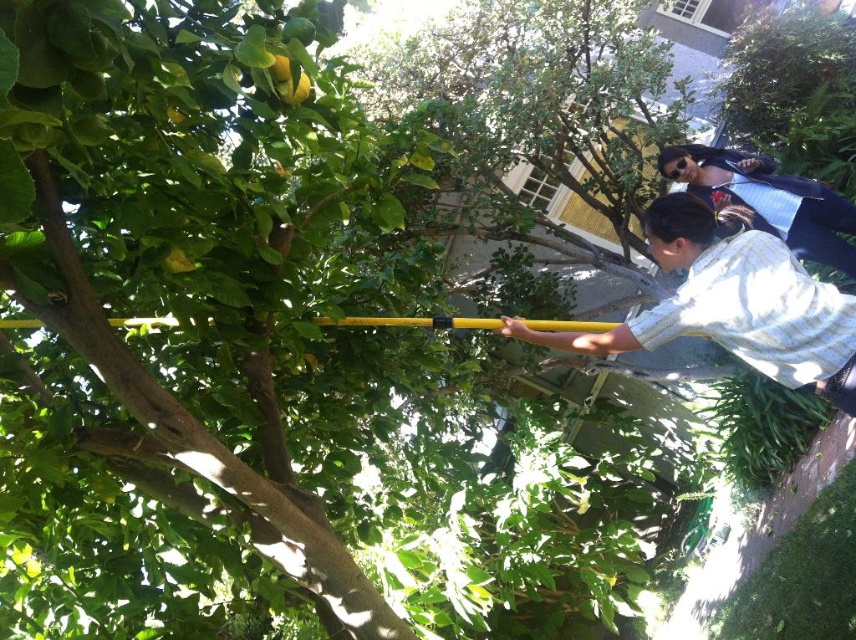
Question: Does denim jacket at upper right have a larger size compared to yellow matte pole at center?

Choices:
 (A) yes
 (B) no

Answer: (A)

Question: Observing the image, what is the correct spatial positioning of denim jacket at upper right in reference to yellow matte pole at center?

Choices:
 (A) left
 (B) right

Answer: (B)

Question: Which is farther from the denim jacket at upper right?

Choices:
 (A) yellow matte pole at center
 (B) yellow matte pole at upper right

Answer: (A)

Question: Is yellow matte pole at upper right below denim jacket at upper right?

Choices:
 (A) yes
 (B) no

Answer: (A)

Question: Which of the following is the closest to the observer?

Choices:
 (A) yellow matte pole at upper right
 (B) yellow matte pole at center

Answer: (A)

Question: Which of the following is the closest to the observer?

Choices:
 (A) (700, 182)
 (B) (779, 285)

Answer: (B)